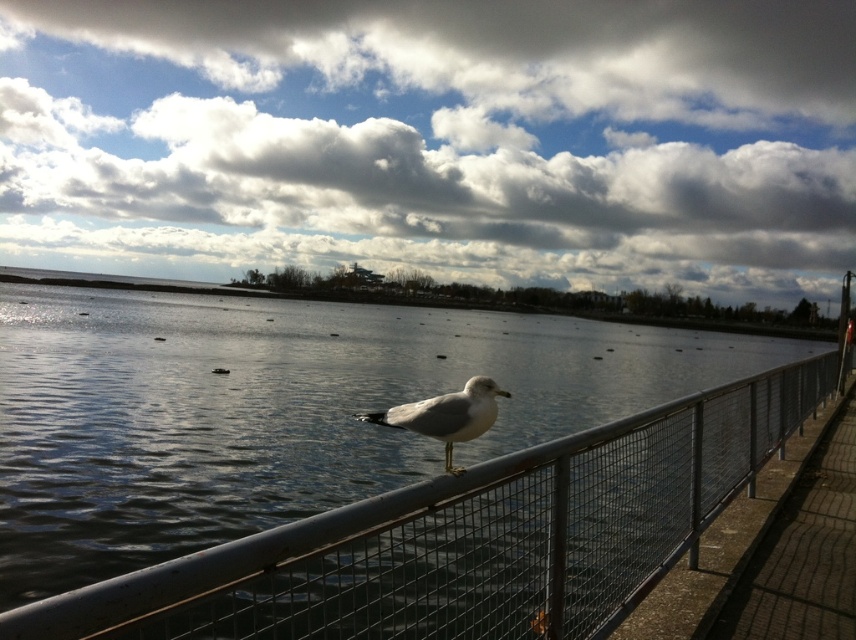
Can you confirm if white fluffy cloud at upper center is positioned to the left of metallic gray fence at center?

Correct, you'll find white fluffy cloud at upper center to the left of metallic gray fence at center.

Does white fluffy cloud at upper center have a lesser width compared to metallic gray fence at center?

Incorrect, white fluffy cloud at upper center's width is not less than metallic gray fence at center's.

Identify the location of white fluffy cloud at upper center. This screenshot has height=640, width=856. (435, 138).

Find the location of a particular element. white fluffy cloud at upper center is located at coordinates (435, 138).

Which is more to the left, metallic gray fence at center or white matte bird at center?

white matte bird at center

Which is behind, point (615, 554) or point (443, 433)?

Positioned behind is point (615, 554).

This screenshot has width=856, height=640. Identify the location of metallic gray fence at center. (471, 538).

What do you see at coordinates (435, 138) in the screenshot? This screenshot has width=856, height=640. I see `white fluffy cloud at upper center` at bounding box center [435, 138].

Is point (583, 42) positioned in front of point (420, 406)?

No, (583, 42) is behind (420, 406).

Where is `white fluffy cloud at upper center`? This screenshot has height=640, width=856. white fluffy cloud at upper center is located at coordinates (435, 138).

Locate an element on the screen. The width and height of the screenshot is (856, 640). white fluffy cloud at upper center is located at coordinates (435, 138).